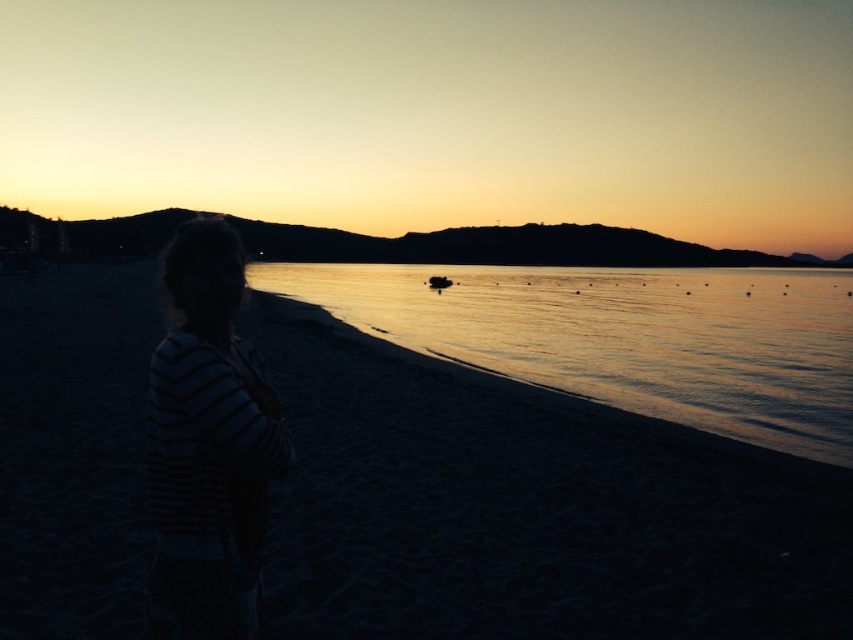
Question: Among these objects, which one is farthest from the camera?

Choices:
 (A) striped fabric at left
 (B) glistening water at center

Answer: (B)

Question: Does dark sand at lower left have a smaller size compared to glistening water at center?

Choices:
 (A) yes
 (B) no

Answer: (A)

Question: Can you confirm if dark sand at lower left is smaller than glistening water at center?

Choices:
 (A) yes
 (B) no

Answer: (A)

Question: Considering the real-world distances, which object is farthest from the striped fabric at left?

Choices:
 (A) dark sand at lower left
 (B) glistening water at center

Answer: (B)

Question: Based on their relative distances, which object is farther from the glistening water at center?

Choices:
 (A) dark sand at lower left
 (B) striped fabric at left

Answer: (A)

Question: Is glistening water at center further to the viewer compared to striped fabric at left?

Choices:
 (A) yes
 (B) no

Answer: (A)